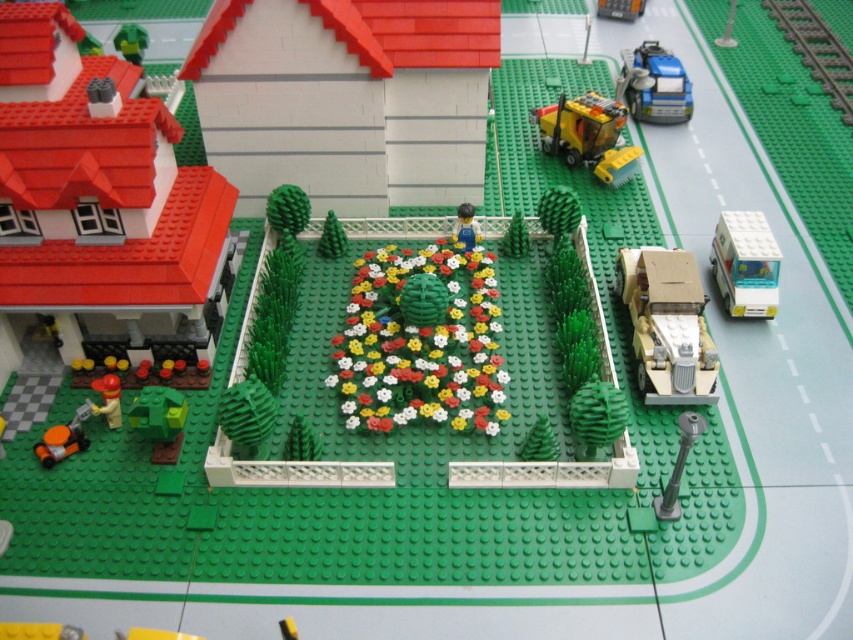
You are a visitor standing in front of the suburban Lego scene. You notice the green matte tree at center and the metallic silver car at upper center. Which object appears taller in the scene?

The green matte tree at center is much taller than the metallic silver car at upper center.

You are a drone operator trying to capture aerial footage of the suburban Lego scene. Your drone is currently hovering above the metallic silver car at upper center. To get a clear shot of the green matte tree at center, should you adjust the drone to move upward or downward?

The green matte tree at center is below the metallic silver car at upper center, so you should move the drone downward to capture the green matte tree at center.